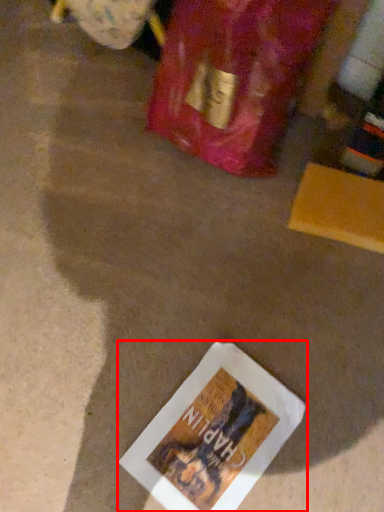
Question: Considering the relative positions of book (annotated by the red box) and wine bottle in the image provided, where is book (annotated by the red box) located with respect to the staircase?

Choices:
 (A) right
 (B) left

Answer: (B)